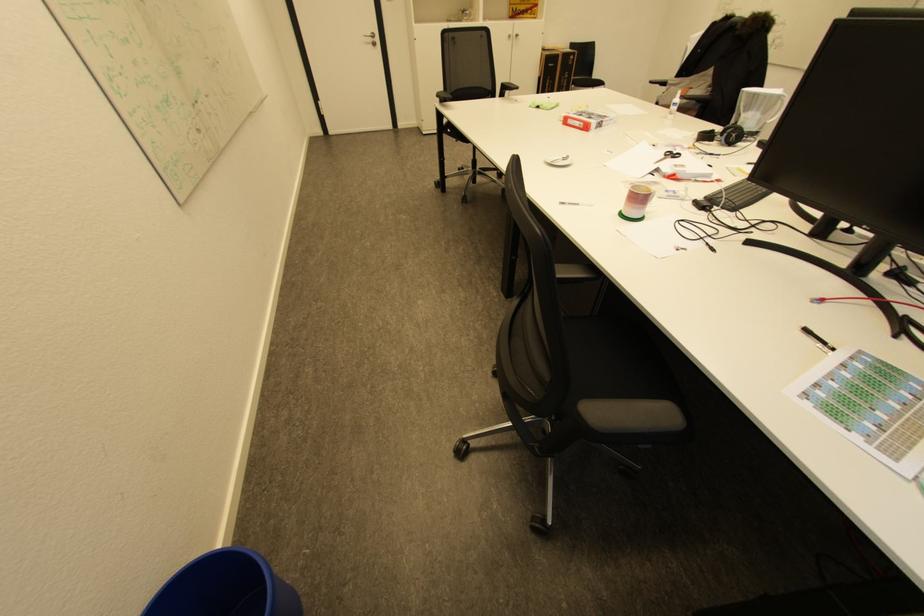
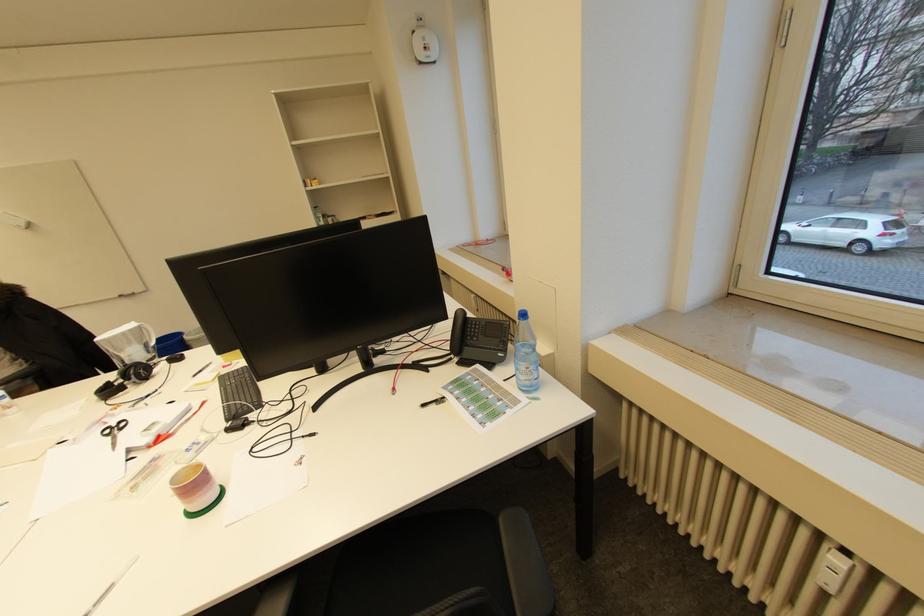
In the second image, find the point that corresponds to point 732,136 in the first image.

(140, 377)